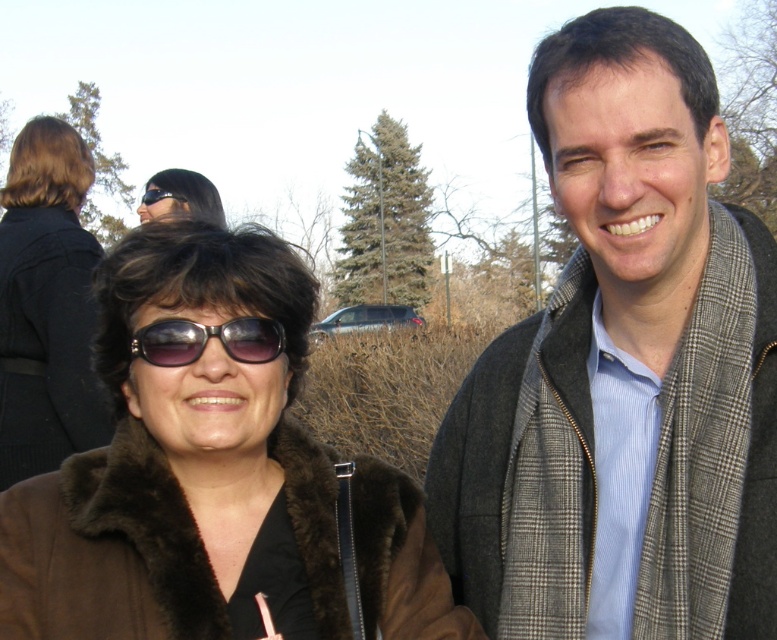
Does black fuzzy coat at left appear on the right side of sunglasses at center?

No, black fuzzy coat at left is not to the right of sunglasses at center.

You are a GUI agent. You are given a task and a screenshot of the screen. Output one action in this format:
    pyautogui.click(x=<x>, y=<y>)
    Task: Click on the black fuzzy coat at left
    This screenshot has width=777, height=640.
    Given the screenshot: What is the action you would take?
    pyautogui.click(x=46, y=305)

Image resolution: width=777 pixels, height=640 pixels. Find the location of `black fuzzy coat at left`. black fuzzy coat at left is located at coordinates (46, 305).

Based on the photo, between brown fur coat at left and sunglasses at center, which one has more height?

Standing taller between the two is brown fur coat at left.

Measure the distance between brown fur coat at left and sunglasses at center.

A distance of 8.20 inches exists between brown fur coat at left and sunglasses at center.

Between point (44, 497) and point (249, 339), which one is positioned in front?

Point (249, 339) is in front.

Locate an element on the screen. This screenshot has height=640, width=777. brown fur coat at left is located at coordinates (183, 465).

Who is taller, plaid scarf at center or black fuzzy coat at left?

black fuzzy coat at left is taller.

Which is in front, point (709, 483) or point (39, 132)?

Point (709, 483) is more forward.

Identify the location of plaid scarf at center. (624, 365).